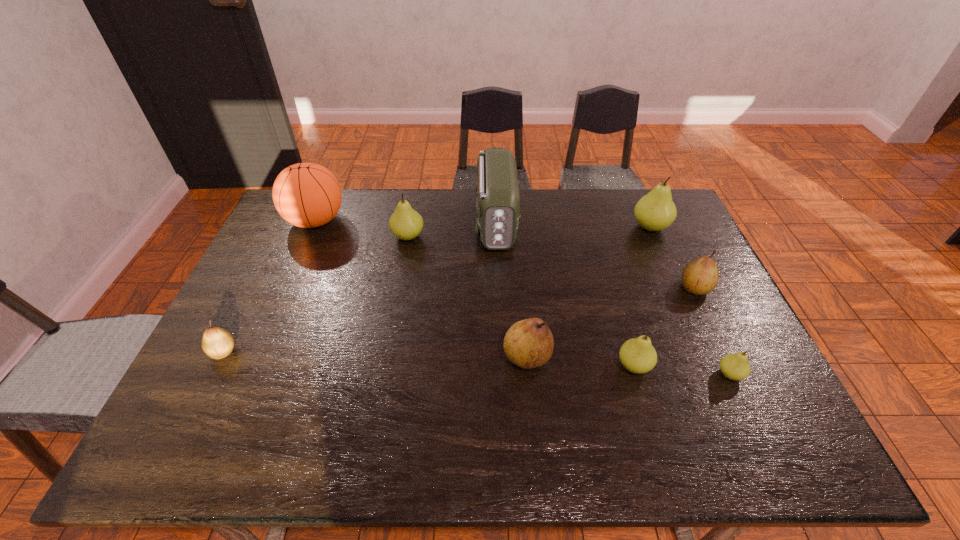
Identify the location of free space between the third pear from left to right and the biggest green pear. The height and width of the screenshot is (540, 960). (588, 292).

Choose which object is the third nearest neighbor to the fifth pear from right to left. Please provide its 2D coordinates. Your answer should be formatted as a tuple, i.e. [(x, y)], where the tuple contains the x and y coordinates of a point satisfying the conditions above.

[(735, 366)]

Locate an element on the screen. The image size is (960, 540). object that can be found as the fourth closest to the smallest green pear is located at coordinates (655, 211).

The height and width of the screenshot is (540, 960). In order to click on pear identified as the sixth closest to the tallest pear in this screenshot , I will do `click(217, 343)`.

Where is `pear that is the fourth closest one to the radio_receiver`? The image size is (960, 540). pear that is the fourth closest one to the radio_receiver is located at coordinates 637,355.

What are the coordinates of `green pear that can be found as the second closest to the fourth object from right to left` in the screenshot? It's located at (655, 211).

Identify which green pear is the second nearest to the radio_receiver. Please provide its 2D coordinates. Your answer should be formatted as a tuple, i.e. [(x, y)], where the tuple contains the x and y coordinates of a point satisfying the conditions above.

[(655, 211)]

Locate an element on the screen. The image size is (960, 540). the second closest brown pear to the biggest brown pear is located at coordinates (217, 343).

Locate which brown pear is the closest to the leftmost pear. Please provide its 2D coordinates. Your answer should be formatted as a tuple, i.e. [(x, y)], where the tuple contains the x and y coordinates of a point satisfying the conditions above.

[(529, 343)]

I want to click on vacant space that satisfies the following two spatial constraints: 1. on the front side of the basketball; 2. on the right side of the biggest brown pear, so click(x=258, y=357).